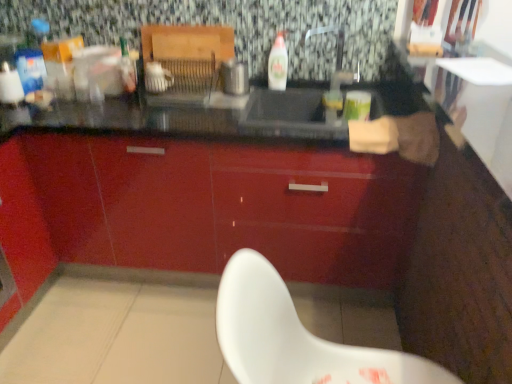
The height and width of the screenshot is (384, 512). Find the location of `vacant area located to the right-hand side of white glossy bottle at center`. vacant area located to the right-hand side of white glossy bottle at center is located at coordinates click(x=305, y=91).